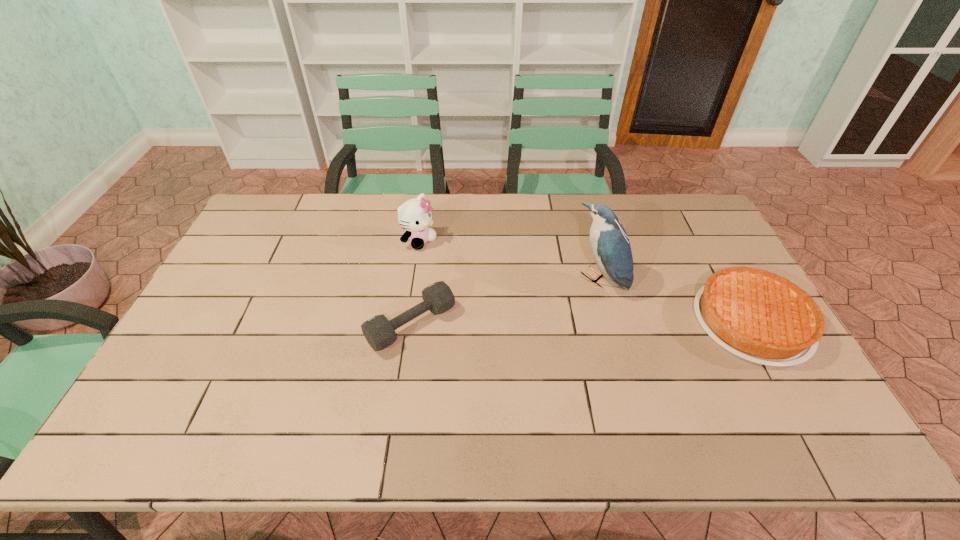
Locate an element on the screen. free space between the rightmost object and the second tallest object is located at coordinates (586, 281).

Identify which object is the second closest to the third object from left to right. Please provide its 2D coordinates. Your answer should be formatted as a tuple, i.e. [(x, y)], where the tuple contains the x and y coordinates of a point satisfying the conditions above.

[(379, 332)]

Choose which object is the second nearest neighbor to the dumbbell. Please provide its 2D coordinates. Your answer should be formatted as a tuple, i.e. [(x, y)], where the tuple contains the x and y coordinates of a point satisfying the conditions above.

[(610, 245)]

Locate an element on the screen. vacant region that satisfies the following two spatial constraints: 1. on the back side of the pie; 2. on the right side of the dumbbell is located at coordinates (412, 322).

Locate an element on the screen. The width and height of the screenshot is (960, 540). vacant area in the image that satisfies the following two spatial constraints: 1. on the front side of the rightmost object; 2. on the left side of the kitten is located at coordinates (407, 322).

This screenshot has height=540, width=960. I want to click on free space that satisfies the following two spatial constraints: 1. on the front side of the third shortest object; 2. on the right side of the pie, so click(407, 322).